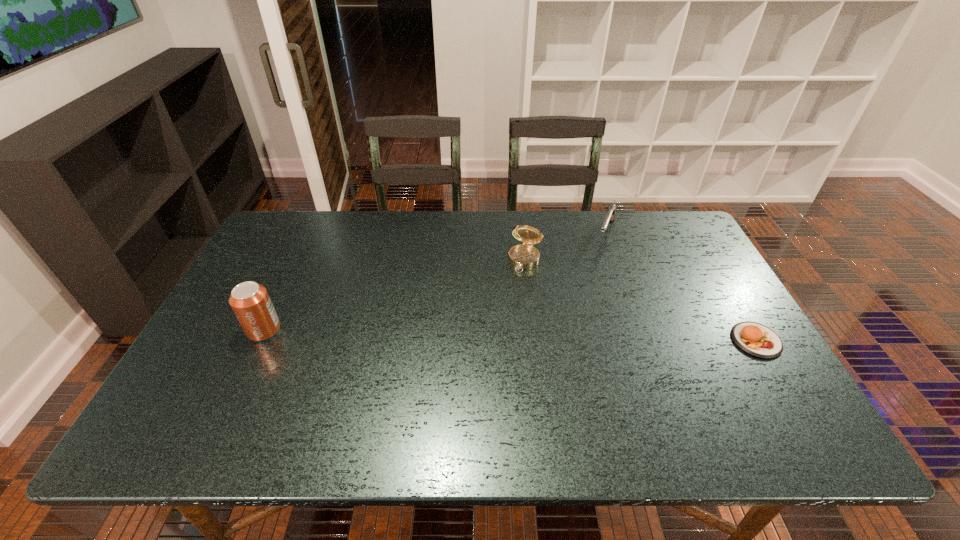
Where is `free space in the image that satisfies the following two spatial constraints: 1. on the back side of the gun; 2. on the right side of the third shortest object`? The height and width of the screenshot is (540, 960). free space in the image that satisfies the following two spatial constraints: 1. on the back side of the gun; 2. on the right side of the third shortest object is located at coordinates (522, 233).

Where is `free point that satisfies the following two spatial constraints: 1. on the front side of the gun; 2. on the right side of the shortest object`? This screenshot has height=540, width=960. free point that satisfies the following two spatial constraints: 1. on the front side of the gun; 2. on the right side of the shortest object is located at coordinates (644, 340).

Identify the location of free spot that satisfies the following two spatial constraints: 1. on the front side of the shortest object; 2. on the left side of the leftmost object. (259, 340).